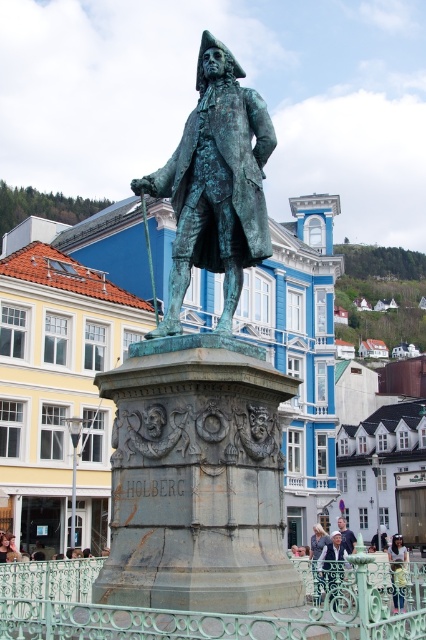
Question: Can you confirm if green patina statue at center is thinner than light brown wood man at center?

Choices:
 (A) yes
 (B) no

Answer: (A)

Question: Is bronze statue at center to the left of light blue fabric jacket at lower center from the viewer's perspective?

Choices:
 (A) yes
 (B) no

Answer: (A)

Question: Which object appears farthest from the camera in this image?

Choices:
 (A) light brown leather jacket at center
 (B) bronze statue at center
 (C) green wrought iron railing at center

Answer: (A)

Question: Which point appears farthest from the camera in this image?

Choices:
 (A) (80, 579)
 (B) (347, 538)
 (C) (399, 579)

Answer: (B)

Question: Which point is closer to the camera taking this photo?

Choices:
 (A) pyautogui.click(x=402, y=556)
 (B) pyautogui.click(x=112, y=616)
 (C) pyautogui.click(x=230, y=266)
 (D) pyautogui.click(x=101, y=602)

Answer: (B)

Question: Does green patina statue at center appear on the right side of green wrought iron railing at center?

Choices:
 (A) no
 (B) yes

Answer: (A)